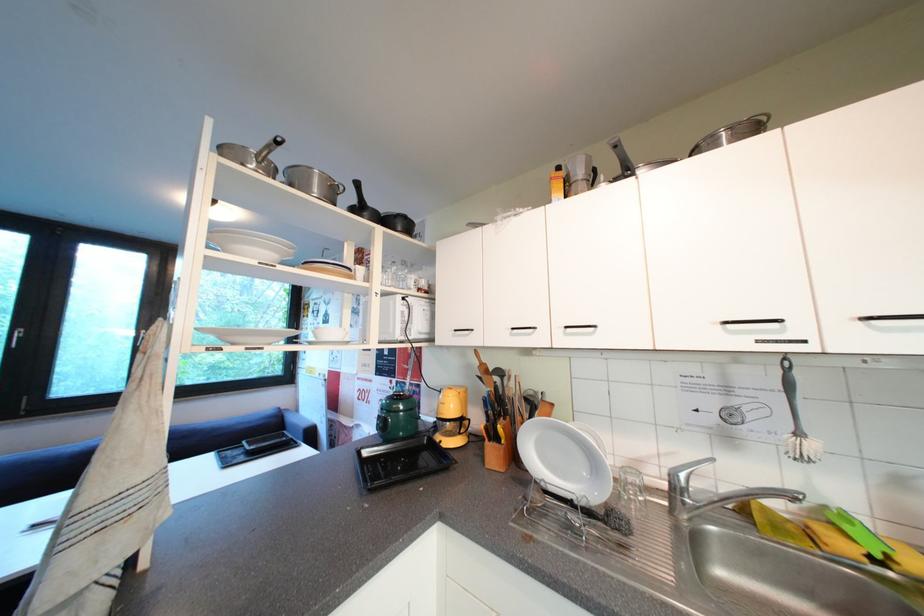
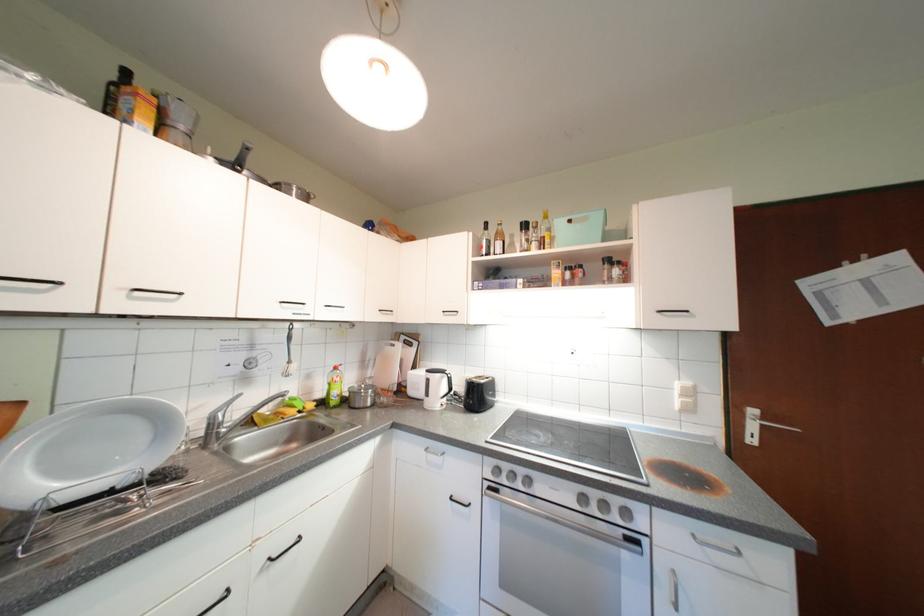
Find the pixel in the second image that matches [681,477] in the first image.

(220, 419)